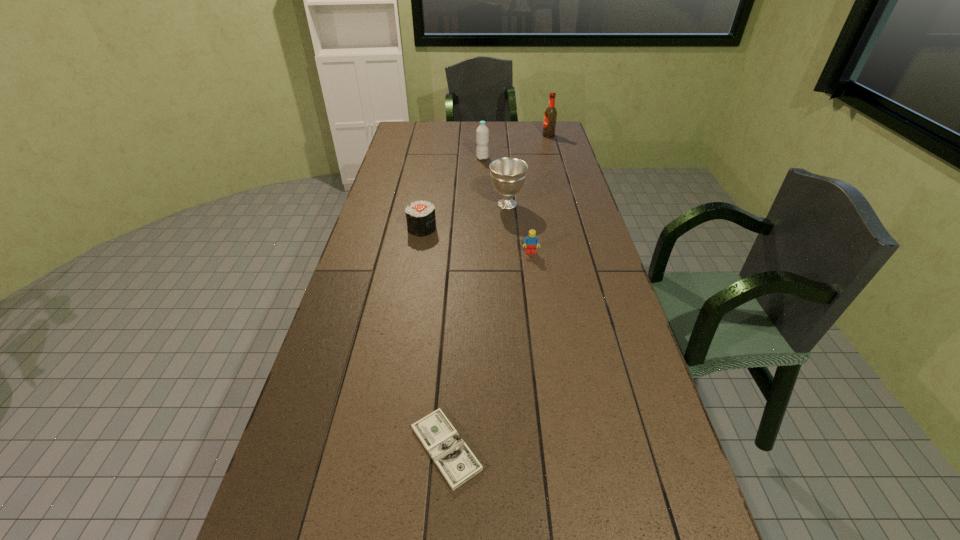
At what (x,y) coordinates should I click in order to perform the action: click on free location located on the back of the water bottle. Please return your answer as a coordinate pair (x, y). This screenshot has height=540, width=960. Looking at the image, I should click on (482, 141).

Identify the location of free space located on the left of the fourth nearest object. Image resolution: width=960 pixels, height=540 pixels. (430, 204).

The width and height of the screenshot is (960, 540). I want to click on vacant position located on the back of the leftmost object, so click(x=428, y=191).

Identify the location of free space located on the face of the fifth farthest object. pos(542,335).

At what (x,y) coordinates should I click in order to perform the action: click on free point located 0.070m on the right of the dollar. Please return your answer as a coordinate pair (x, y). Looking at the image, I should click on (515, 448).

The image size is (960, 540). I want to click on object that is at the far edge, so click(x=550, y=115).

This screenshot has height=540, width=960. Find the location of `object at the left edge`. object at the left edge is located at coordinates (421, 220).

I want to click on object that is at the right edge, so click(550, 115).

In order to click on object at the far right corner in this screenshot , I will do `click(550, 115)`.

Image resolution: width=960 pixels, height=540 pixels. I want to click on free spot at the far edge of the desktop, so click(x=467, y=123).